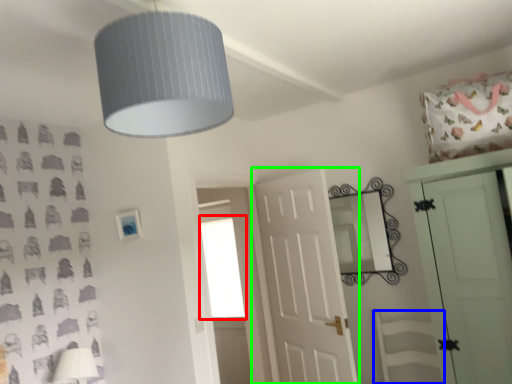
Question: Which object is the farthest from window (highlighted by a red box)? Choose among these: swivel chair (highlighted by a blue box) or door (highlighted by a green box).

Choices:
 (A) swivel chair
 (B) door

Answer: (A)